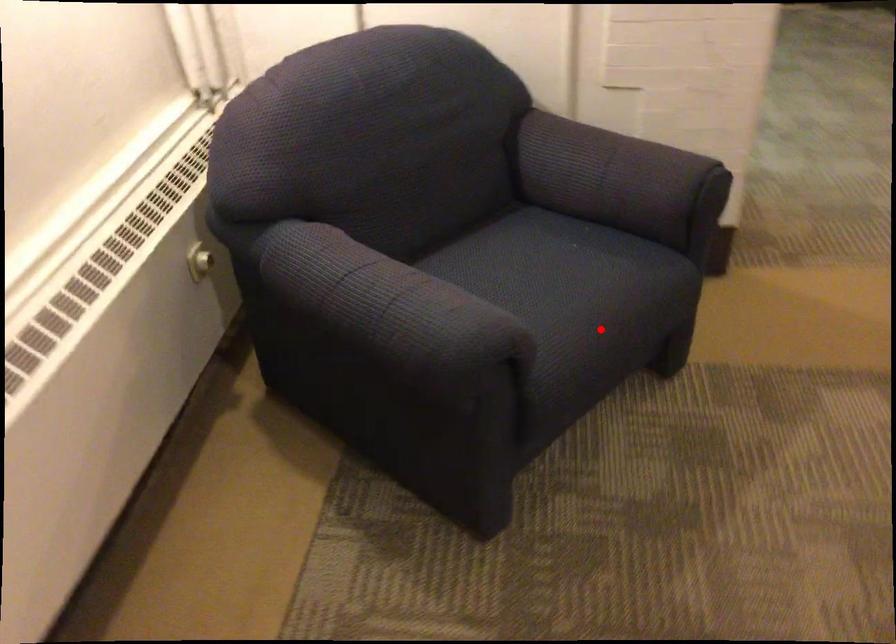
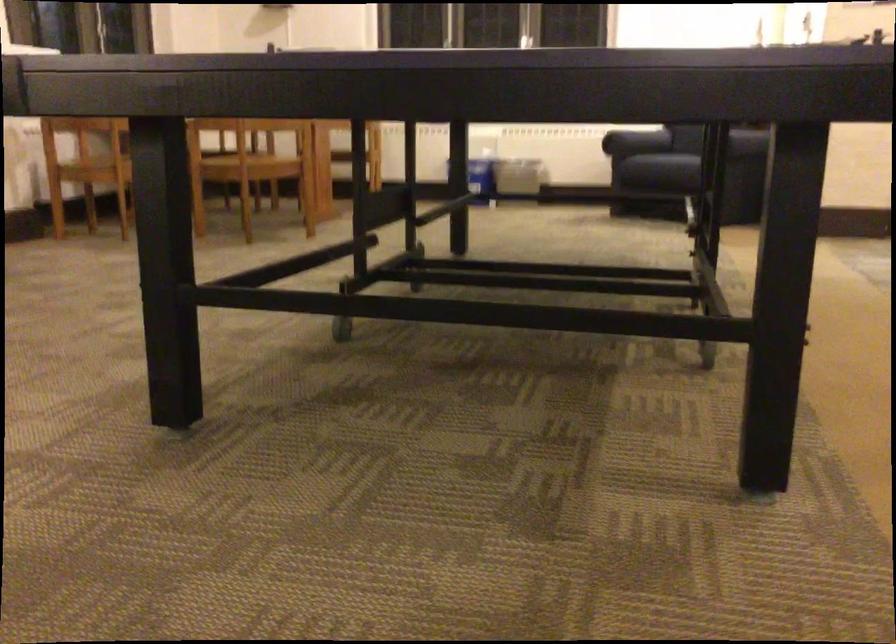
Question: I am providing you with two images of the same scene from different viewpoints. A red point is marked on the first image. At the location where the point appears in image 1, is it still visible in image 2?

Choices:
 (A) Yes
 (B) No

Answer: (A)